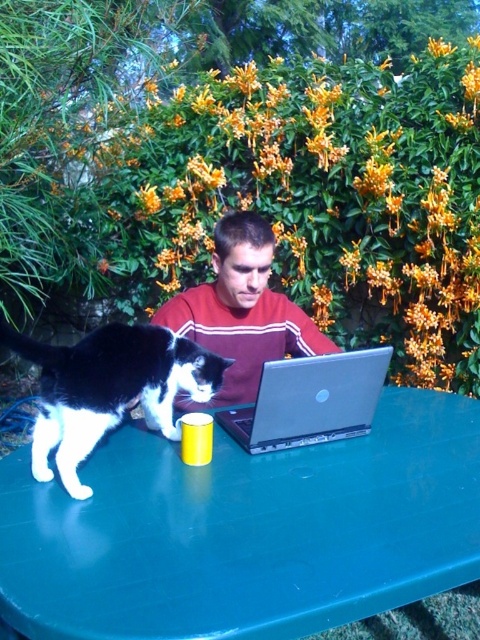
You are a photographer standing in front of the green table where the person is working. You want to take a closeup photo of the black and white fur cat at left without moving the cat. Can you get a clear shot of the cat from your current position?

The black and white fur cat at left is 1.10 meters from viewer, so yes, you can get a clear closeup shot of the cat from your current position as it is within a reasonable distance for photography.

You are trying to place a large plant pot between the green plastic table at center and the black and white fur cat at left. Based on their positions, which side of the cat should you place the pot to ensure it stays between them?

The green plastic table at center is to the right of the black and white fur cat at left. To place the large plant pot between them, you should position it to the right side of the black and white fur cat at left so it stays between the cat and the table.

You are planning to place a new decorative item on the green plastic table at center where there is already a silver metallic laptop at center. Considering their sizes, will the table have enough space for both items?

The green plastic table at center is larger in size than the silver metallic laptop at center, so there should be sufficient space to accommodate both items on the table.